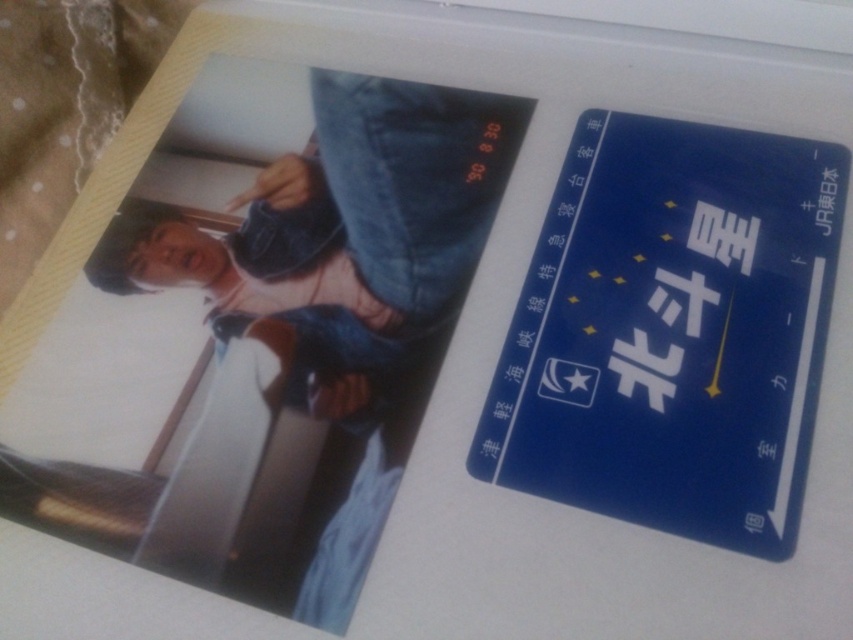
Question: Which object appears closest to the camera in this image?

Choices:
 (A) denim jacket at upper center
 (B) blue card at upper right

Answer: (B)

Question: Is blue card at upper right below denim jacket at upper center?

Choices:
 (A) yes
 (B) no

Answer: (A)

Question: Can you confirm if blue card at upper right is bigger than denim jacket at upper center?

Choices:
 (A) yes
 (B) no

Answer: (A)

Question: Which object appears closest to the camera in this image?

Choices:
 (A) blue card at upper right
 (B) denim jacket at upper center

Answer: (A)

Question: Which point is farther to the camera?

Choices:
 (A) blue card at upper right
 (B) denim jacket at upper center

Answer: (B)

Question: Is blue card at upper right wider than denim jacket at upper center?

Choices:
 (A) yes
 (B) no

Answer: (B)